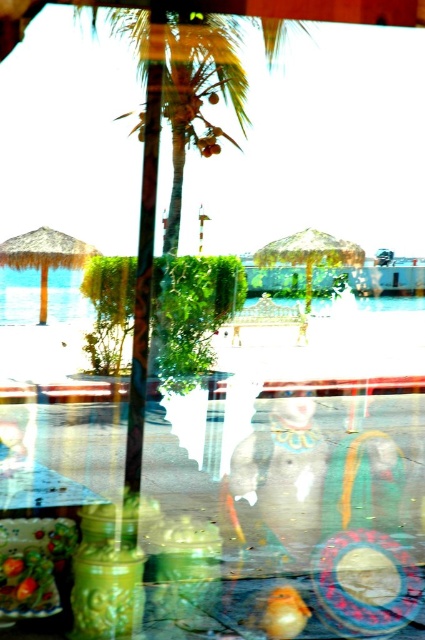
Is green matte glass jar at center to the right of shiny brown coconut at center from the viewer's perspective?

In fact, green matte glass jar at center is to the left of shiny brown coconut at center.

Does green matte glass jar at center appear on the left side of shiny brown coconut at center?

Indeed, green matte glass jar at center is positioned on the left side of shiny brown coconut at center.

Between point (189, 582) and point (217, 97), which one is positioned behind?

The point (217, 97) is more distant.

The image size is (425, 640). What are the coordinates of `green matte glass jar at center` in the screenshot? It's located at (181, 566).

Can you confirm if ripe orange fruit at center is smaller than shiny brown coconut at center?

No.

Does ripe orange fruit at center appear on the left side of shiny brown coconut at center?

Yes, ripe orange fruit at center is to the left of shiny brown coconut at center.

Describe the element at coordinates (209, 141) in the screenshot. The height and width of the screenshot is (640, 425). I see `ripe orange fruit at center` at that location.

Where is `ripe orange fruit at center`? The width and height of the screenshot is (425, 640). ripe orange fruit at center is located at coordinates (209, 141).

Looking at this image, which is more to the left, green glossy jar at center or ripe orange fruit at center?

From the viewer's perspective, green glossy jar at center appears more on the left side.

Is point (133, 561) more distant than point (209, 141)?

No.

Identify the location of green glossy jar at center. This screenshot has width=425, height=640. (107, 592).